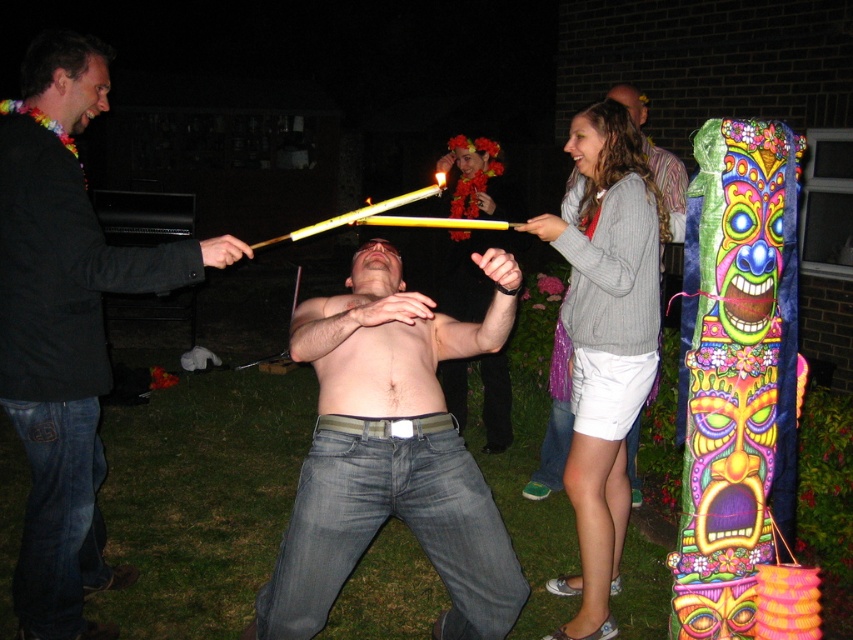
Is gray sweater at upper center shorter than matte black shirt at upper center?

No.

Between gray sweater at upper center and matte black shirt at upper center, which one is positioned lower?

gray sweater at upper center is lower down.

This screenshot has height=640, width=853. I want to click on gray sweater at upper center, so click(x=604, y=340).

Is black leather jacket at left taller than matte black shirt at upper center?

Yes.

Who is more forward, (74,628) or (469,214)?

Point (74,628) is more forward.

Locate an element on the screen. black leather jacket at left is located at coordinates (65, 326).

Does denim jeans at center have a lesser width compared to black leather jacket at left?

In fact, denim jeans at center might be wider than black leather jacket at left.

From the picture: Is denim jeans at center closer to camera compared to black leather jacket at left?

Yes, it is in front of black leather jacket at left.

Locate an element on the screen. denim jeans at center is located at coordinates (392, 452).

You are a GUI agent. You are given a task and a screenshot of the screen. Output one action in this format:
    pyautogui.click(x=<x>, y=<y>)
    Task: Click on the denim jeans at center
    
    Given the screenshot: What is the action you would take?
    pyautogui.click(x=392, y=452)